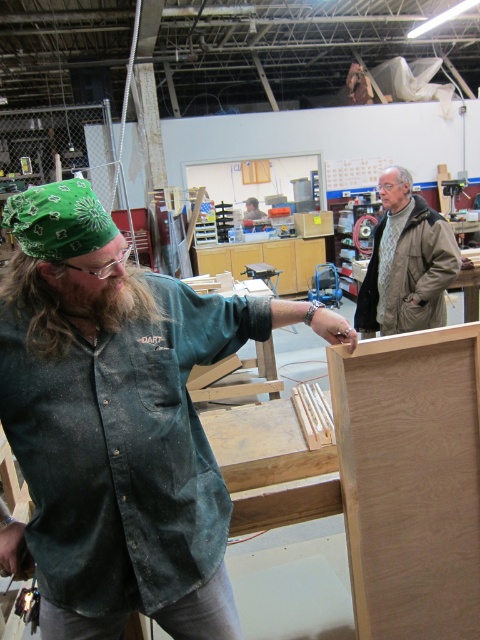
Question: Considering the relative positions of bare wood board at center and gray wool sweater at upper right in the image provided, where is bare wood board at center located with respect to gray wool sweater at upper right?

Choices:
 (A) left
 (B) right

Answer: (A)

Question: Estimate the real-world distances between objects in this image. Which object is closer to the gray wool sweater at upper right?

Choices:
 (A) dark green corduroy shirt at left
 (B) bare wood board at center

Answer: (B)

Question: From the image, what is the correct spatial relationship of dark green corduroy shirt at left in relation to bare wood board at center?

Choices:
 (A) left
 (B) right

Answer: (A)

Question: Which object is positioned farthest from the bare wood board at center?

Choices:
 (A) gray wool sweater at upper right
 (B) dark green corduroy shirt at left

Answer: (A)

Question: Which object appears farthest from the camera in this image?

Choices:
 (A) bare wood board at center
 (B) dark green corduroy shirt at left
 (C) gray wool sweater at upper right

Answer: (C)

Question: Is bare wood board at center positioned before gray wool sweater at upper right?

Choices:
 (A) no
 (B) yes

Answer: (B)